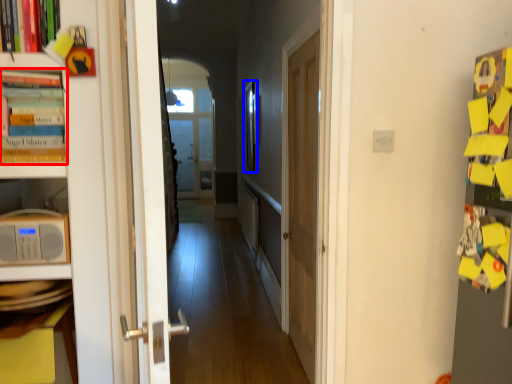
Question: Which object is further to the camera taking this photo, book (highlighted by a red box) or picture frame (highlighted by a blue box)?

Choices:
 (A) book
 (B) picture frame

Answer: (B)